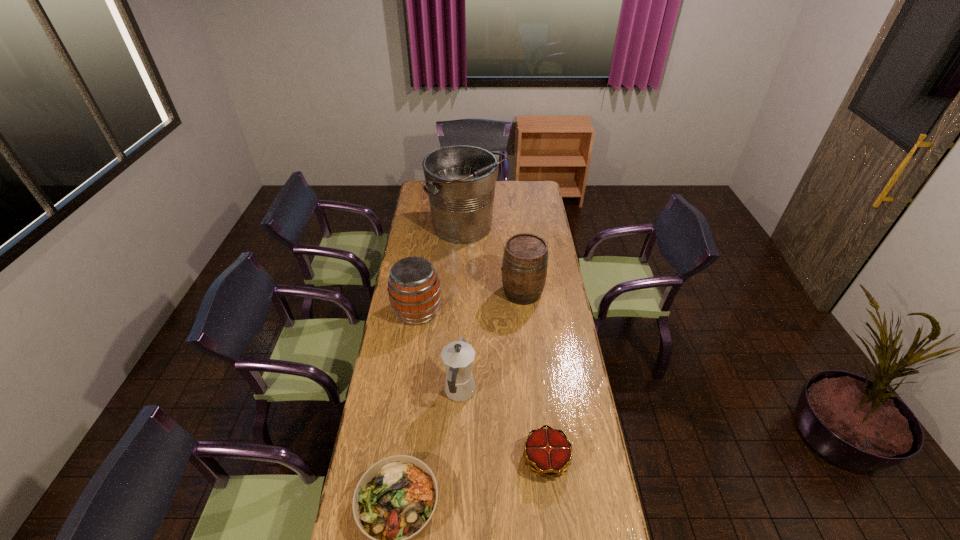
Where is `bucket`? This screenshot has width=960, height=540. bucket is located at coordinates (460, 180).

The image size is (960, 540). I want to click on the tallest object, so click(x=460, y=180).

Locate an element on the screen. the right cider is located at coordinates 524,268.

I want to click on the third nearest object, so click(x=458, y=356).

The image size is (960, 540). In order to click on the left cider in this screenshot , I will do `click(414, 291)`.

In order to click on crown in this screenshot , I will do `click(547, 451)`.

Where is `free space located 0.210m on the front of the bucket`? free space located 0.210m on the front of the bucket is located at coordinates (465, 278).

Find the location of a particular element. The image size is (960, 540). blank area located 0.380m on the side of the right cider near the bung hole is located at coordinates (423, 292).

The width and height of the screenshot is (960, 540). In order to click on free location located 0.230m on the side of the right cider near the bung hole in this screenshot , I will do `click(454, 292)`.

Identify the location of vacant space located on the side of the right cider near the bung hole. The image size is (960, 540). (491, 292).